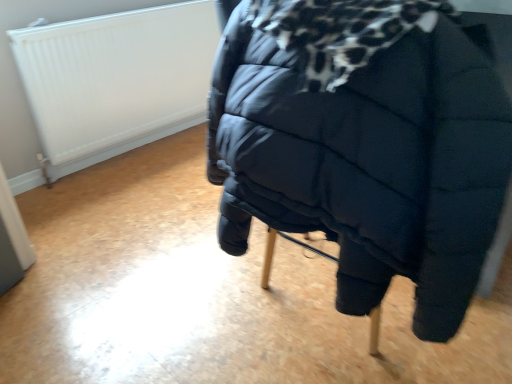
Find the location of a particular element. The image size is (512, 384). free space on the front side of white textured radiator at upper left is located at coordinates tap(128, 204).